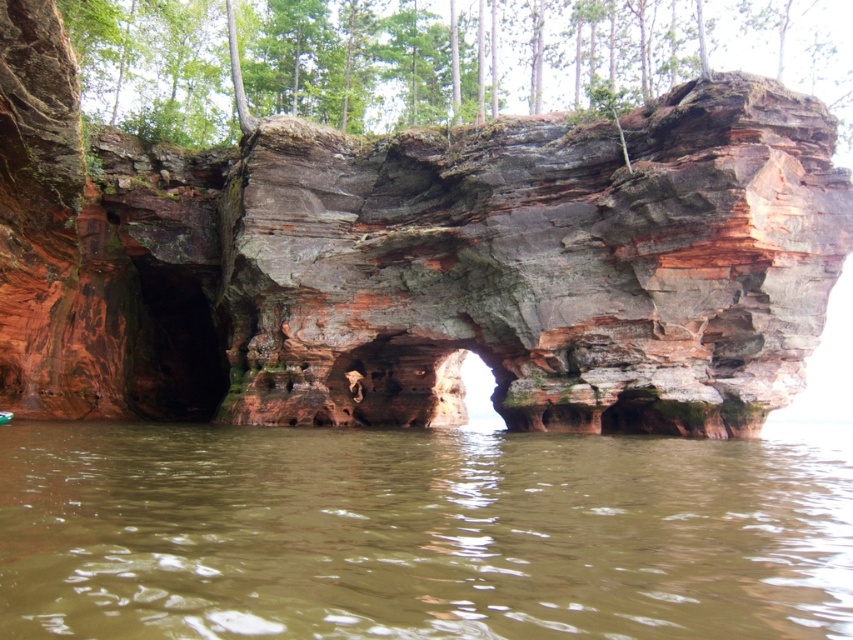
You are a photographer standing at the shoreline facing the rock formation. You want to capture both the point at coordinates point (x=294, y=289) and point (x=680, y=582) in your photo. Which point will appear closer to the front of the image?

Point (x=294, y=289) is further to the camera than point (x=680, y=582), so it will appear closer to the front of the image.

You are a photographer planning to capture the rustic stone arch at center and the brown murky water at lower center in a single frame. Based on their sizes, which object will occupy more space in the photo?

The rustic stone arch at center will occupy more space in the photo because its width is larger than that of the brown murky water at lower center.